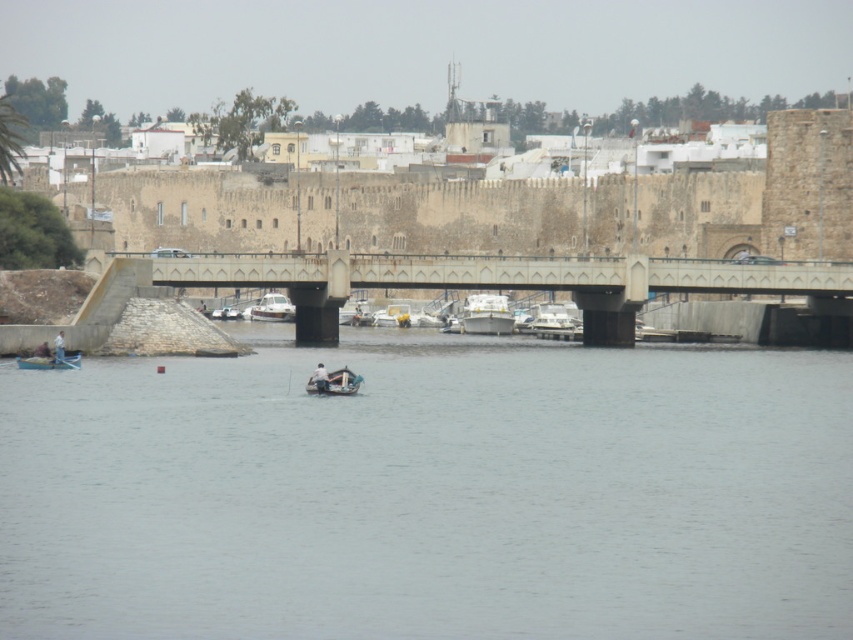
You are standing on the shore and see the wooden boat at lower left and the white fabric boat at center. Which boat is closer to you?

The wooden boat at lower left is closer to you because it is further to the viewer than the white fabric boat at center.

You are a photographer positioned on the left side of the image, aiming to capture both the white glossy boat at center and the wooden boat at center in a single frame. Which boat should you adjust your camera to focus on first to ensure both are in the shot?

You should focus on the wooden boat at center first because the white glossy boat at center is to its right, so adjusting the camera to include both would require framing from the left starting with the wooden boat.

You are a photographer standing at the center of the image. You want to capture a photo of the wooden boat at lower left. Which direction should you move to get a better view of it?

The wooden boat at lower left is located at point (x=49, y=362), so you should move to the left side of the image to get a better view of it.